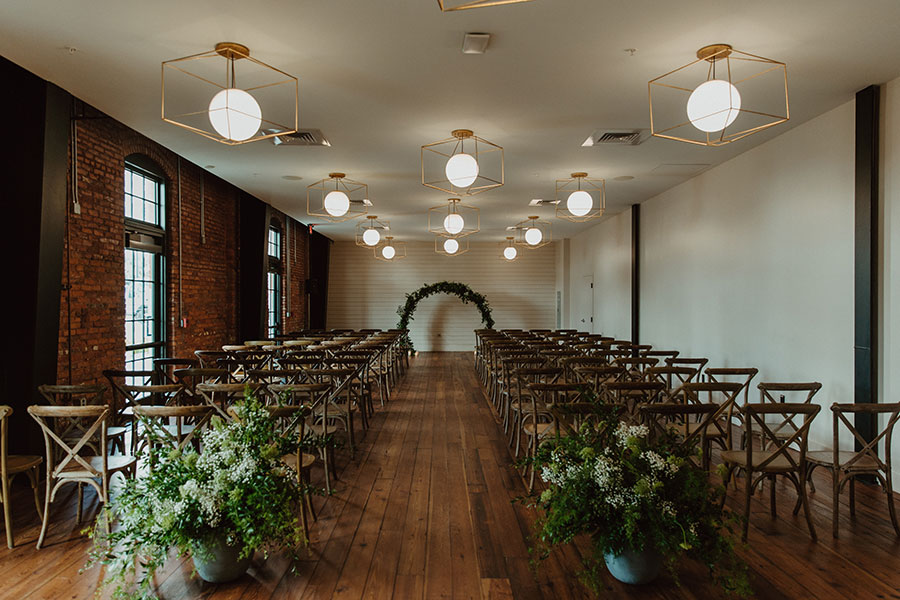
Image resolution: width=900 pixels, height=600 pixels. Identify the location of windows. (150, 302), (274, 292).